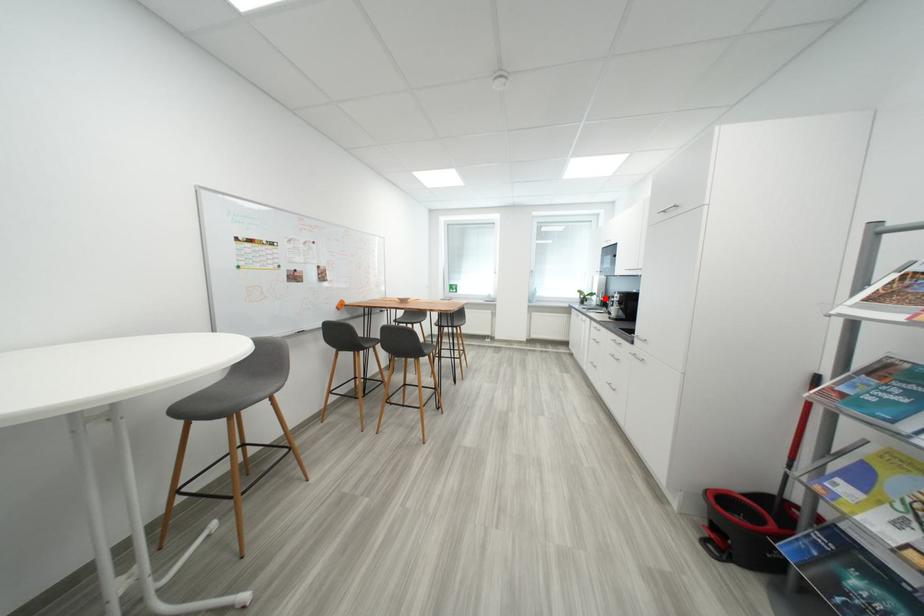
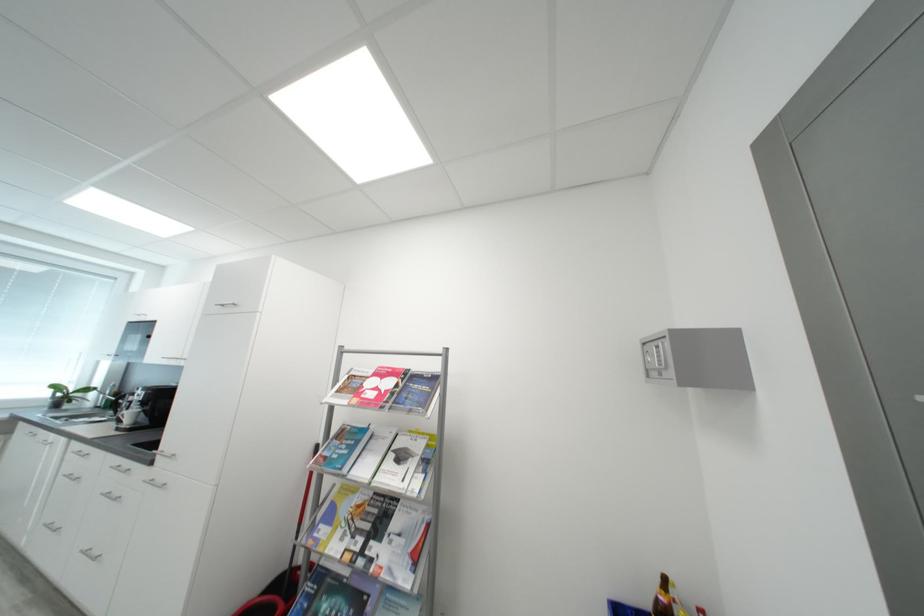
Locate, in the second image, the point that corresponds to the highlighted location in the first image.

(108, 394)